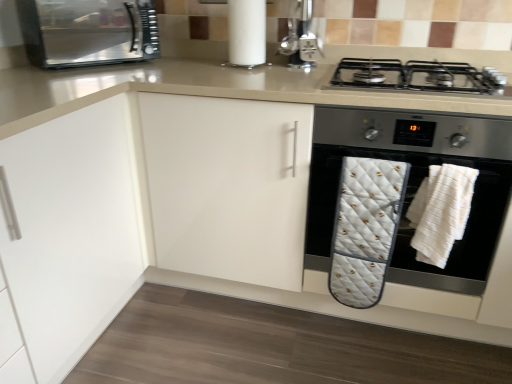
Question: Does metallic stainless steel microwave at upper left have a lesser width compared to white quilted oven mitt at center, which is the first bath towel from left to right?

Choices:
 (A) no
 (B) yes

Answer: (A)

Question: Does metallic stainless steel microwave at upper left have a smaller size compared to white quilted oven mitt at center, which is the first bath towel from left to right?

Choices:
 (A) no
 (B) yes

Answer: (A)

Question: Is metallic stainless steel microwave at upper left looking in the opposite direction of white quilted oven mitt at center, which ranks as the second bath towel in right-to-left order?

Choices:
 (A) yes
 (B) no

Answer: (B)

Question: Is metallic stainless steel microwave at upper left taller than white quilted oven mitt at center, which ranks as the second bath towel in right-to-left order?

Choices:
 (A) yes
 (B) no

Answer: (B)

Question: Is metallic stainless steel microwave at upper left aimed at white quilted oven mitt at center, which is the first bath towel from left to right?

Choices:
 (A) no
 (B) yes

Answer: (A)

Question: Does metallic stainless steel microwave at upper left contain white quilted oven mitt at center, which ranks as the second bath towel in right-to-left order?

Choices:
 (A) yes
 (B) no

Answer: (B)

Question: Are white matte paper towel at upper center and metallic stainless steel microwave at upper left beside each other?

Choices:
 (A) yes
 (B) no

Answer: (B)

Question: Can you confirm if white matte paper towel at upper center is taller than metallic stainless steel microwave at upper left?

Choices:
 (A) yes
 (B) no

Answer: (A)

Question: Considering the relative positions of white matte paper towel at upper center and metallic stainless steel microwave at upper left in the image provided, is white matte paper towel at upper center to the right of metallic stainless steel microwave at upper left from the viewer's perspective?

Choices:
 (A) yes
 (B) no

Answer: (A)

Question: Are white matte paper towel at upper center and metallic stainless steel microwave at upper left far apart?

Choices:
 (A) no
 (B) yes

Answer: (B)

Question: Is white matte paper towel at upper center oriented away from metallic stainless steel microwave at upper left?

Choices:
 (A) yes
 (B) no

Answer: (B)

Question: From the image's perspective, is white matte paper towel at upper center over metallic stainless steel microwave at upper left?

Choices:
 (A) yes
 (B) no

Answer: (B)

Question: Is metallic stainless steel microwave at upper left positioned far away from black matte gas stove at upper right?

Choices:
 (A) yes
 (B) no

Answer: (A)